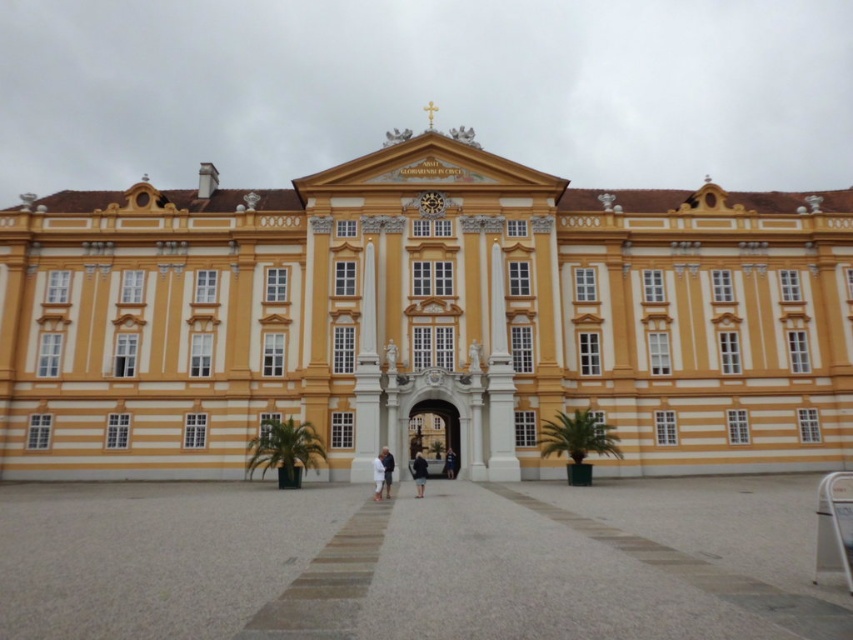
Is yellow matte building at center smaller than white fabric at center?

Actually, yellow matte building at center might be larger than white fabric at center.

Is yellow matte building at center closer to the viewer compared to white fabric at center?

That is False.

Does point (108, 381) come in front of point (381, 460)?

No, (108, 381) is further to viewer.

Identify the location of yellow matte building at center. The height and width of the screenshot is (640, 853). (422, 320).

From the picture: Is yellow matte building at center to the right of gray concrete plaza at center from the viewer's perspective?

No, yellow matte building at center is not to the right of gray concrete plaza at center.

Is point (495, 288) closer to camera compared to point (370, 540)?

No, it is not.

Where is `yellow matte building at center`? yellow matte building at center is located at coordinates (422, 320).

Which is in front, point (376, 468) or point (390, 474)?

Point (376, 468)

Image resolution: width=853 pixels, height=640 pixels. What do you see at coordinates (378, 474) in the screenshot? I see `white fabric at center` at bounding box center [378, 474].

Locate an element on the screen. Image resolution: width=853 pixels, height=640 pixels. white fabric at center is located at coordinates (378, 474).